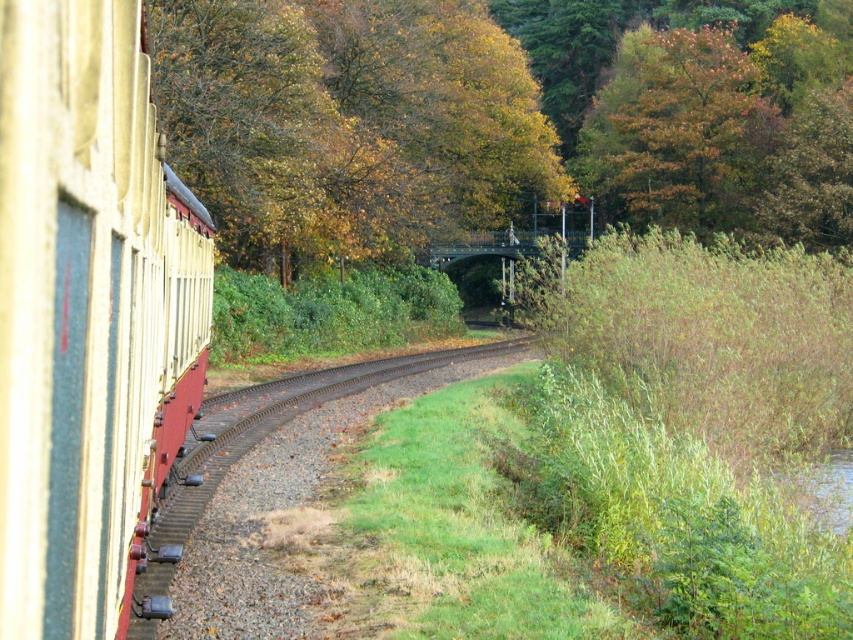
Can you confirm if yellow-green foliage at upper center is positioned above gravel track at center?

Yes.

Which is in front, point (654, 65) or point (233, 422)?

Positioned in front is point (233, 422).

Describe the element at coordinates (502, 118) in the screenshot. Image resolution: width=853 pixels, height=640 pixels. I see `yellow-green foliage at upper center` at that location.

The image size is (853, 640). Identify the location of yellow-green foliage at upper center. (502, 118).

Does orange-brown foliage at upper right have a lesser height compared to gravel track at center?

No.

Does orange-brown foliage at upper right have a smaller size compared to gravel track at center?

A: Actually, orange-brown foliage at upper right might be larger than gravel track at center.

This screenshot has width=853, height=640. Find the location of `orange-brown foliage at upper right`. orange-brown foliage at upper right is located at coordinates (677, 128).

Which is above, matte cream train car at left or gravel track at center?

matte cream train car at left

Consider the image. Can you confirm if matte cream train car at left is taller than gravel track at center?

Indeed, matte cream train car at left has a greater height compared to gravel track at center.

Does point (113, 144) come farther from viewer compared to point (393, 372)?

No, (113, 144) is closer to viewer.

You are a GUI agent. You are given a task and a screenshot of the screen. Output one action in this format:
    pyautogui.click(x=<x>, y=<y>)
    Task: Click on the matte cream train car at left
    Image resolution: width=853 pixels, height=640 pixels.
    Given the screenshot: What is the action you would take?
    [x=88, y=314]